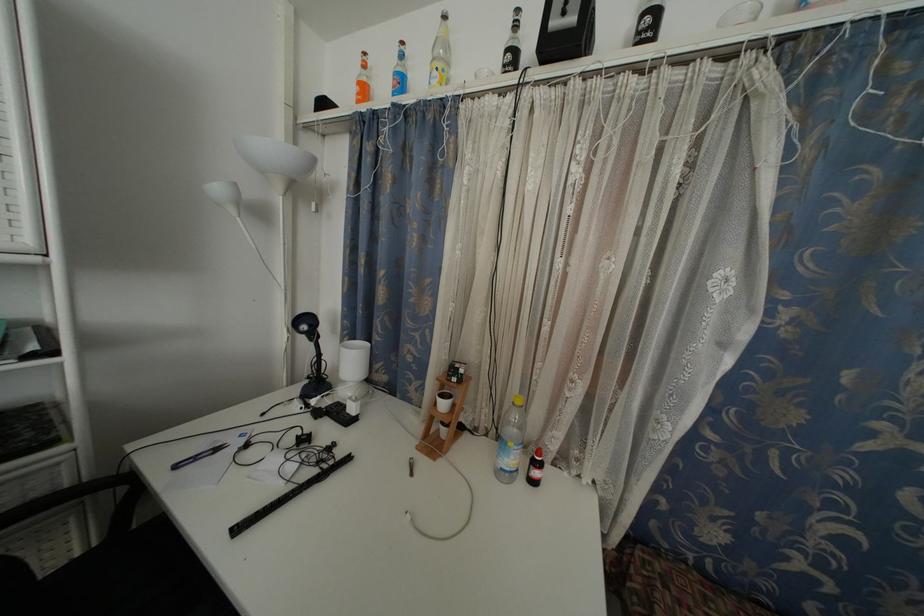
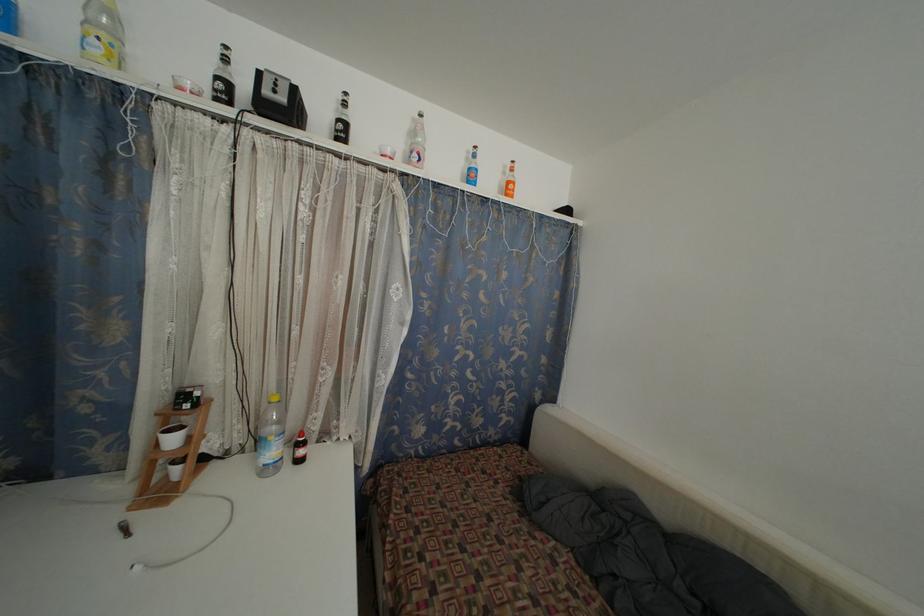
In the second image, find the point that corresponds to pixel 443 436 in the first image.

(171, 480)